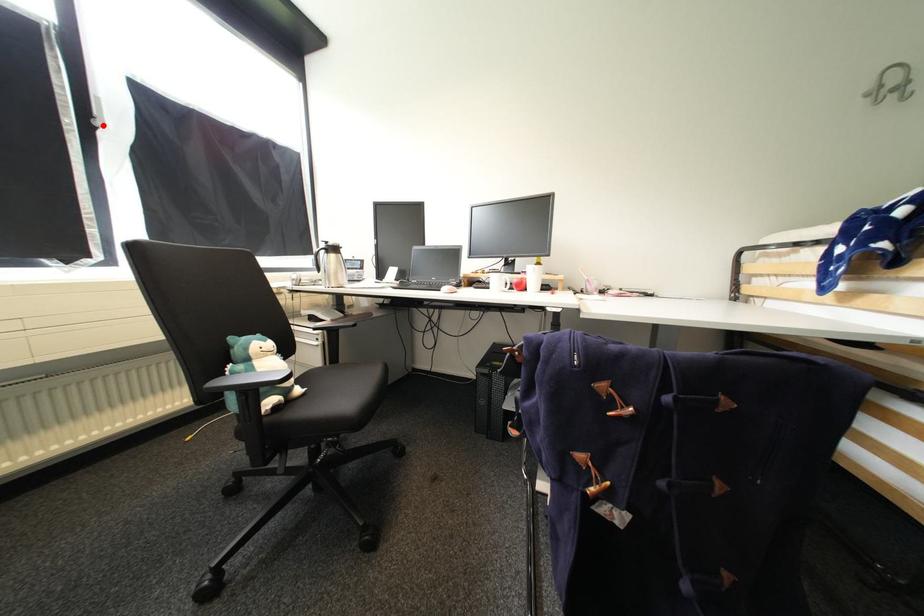
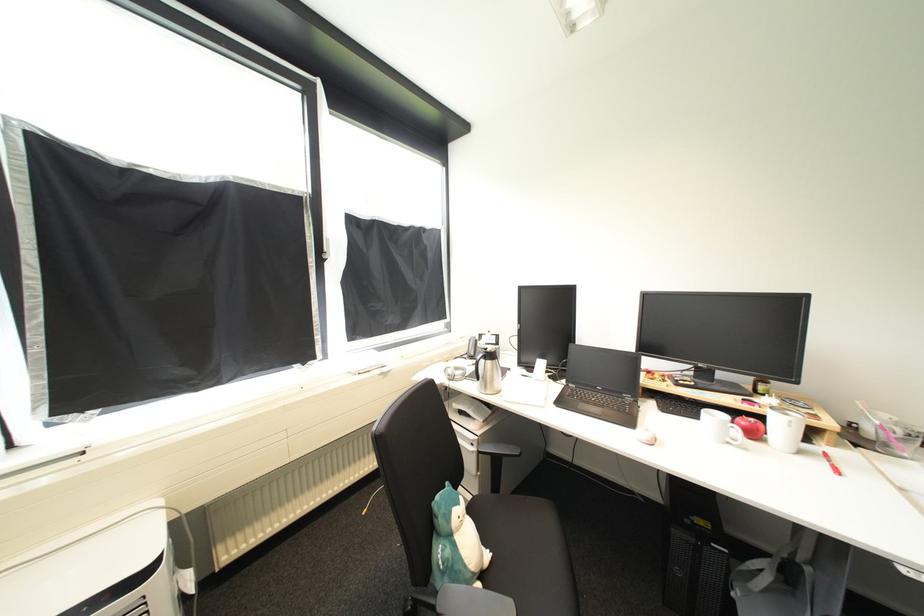
In the second image, find the point that corresponds to the highlighted location in the first image.

(331, 257)